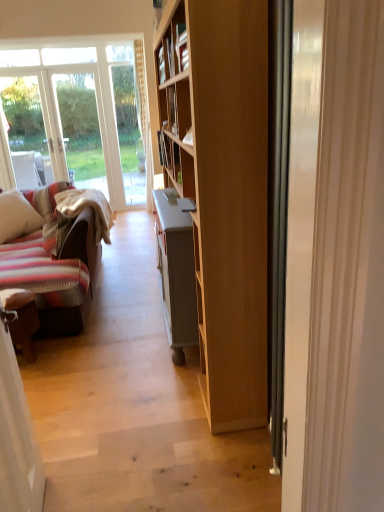
Question: Is white glossy door at right taller or shorter than striped fabric pillow at left?

Choices:
 (A) short
 (B) tall

Answer: (B)

Question: Is point (291, 238) positioned closer to the camera than point (11, 224)?

Choices:
 (A) farther
 (B) closer

Answer: (B)

Question: Which of these objects is positioned closest to the white glossy door at right?

Choices:
 (A) striped fabric pillow at left
 (B) brown leather chair at lower left

Answer: (B)

Question: Estimate the real-world distances between objects in this image. Which object is closer to the white glossy door at right?

Choices:
 (A) brown leather chair at lower left
 (B) striped fabric pillow at left

Answer: (A)